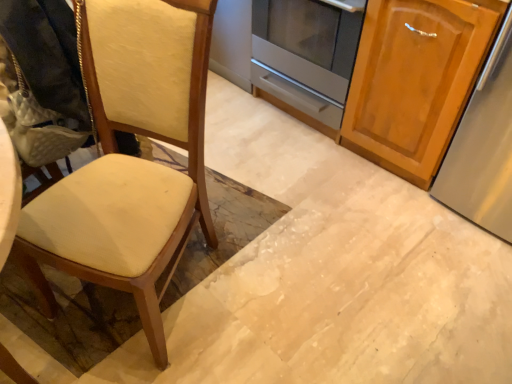
Question: In terms of height, does matte cream fabric chair at left look taller or shorter compared to wooden cabinet at right?

Choices:
 (A) short
 (B) tall

Answer: (B)

Question: Is matte cream fabric chair at left inside the boundaries of wooden cabinet at right, or outside?

Choices:
 (A) inside
 (B) outside

Answer: (B)

Question: Which of these objects is positioned closest to the satin silver oven at center?

Choices:
 (A) matte cream fabric chair at left
 (B) wooden cabinet at right

Answer: (B)

Question: Which of these objects is positioned closest to the matte cream fabric chair at left?

Choices:
 (A) wooden cabinet at right
 (B) satin silver oven at center

Answer: (A)